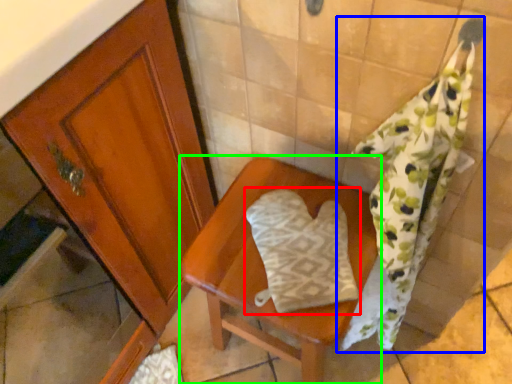
Question: Which is farther away from throw pillow (highlighted by a red box)? bath towel (highlighted by a blue box) or furniture (highlighted by a green box)?

Choices:
 (A) bath towel
 (B) furniture

Answer: (A)